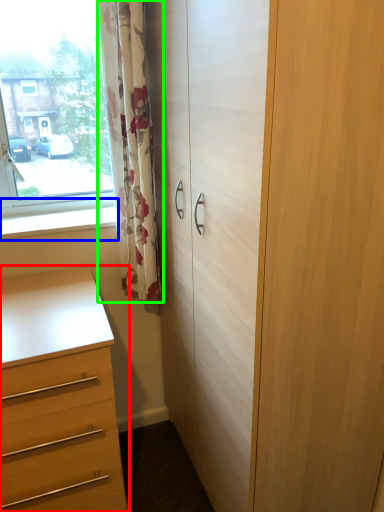
Question: Based on their relative distances, which object is nearer to chest of drawers (highlighted by a red box)? Choose from window sill (highlighted by a blue box) and curtain (highlighted by a green box).

Choices:
 (A) window sill
 (B) curtain

Answer: (A)